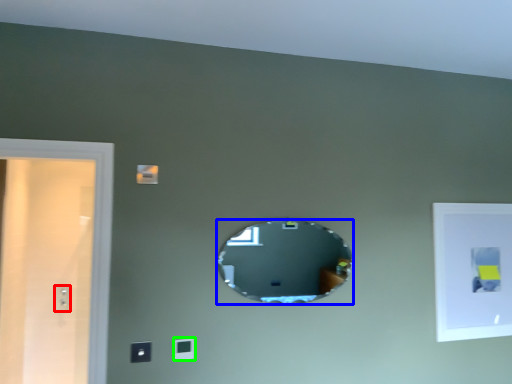
Question: Which object is the closest to the electric outlet (highlighted by a red box)? Choose among these: mirror (highlighted by a blue box) or light switch (highlighted by a green box).

Choices:
 (A) mirror
 (B) light switch

Answer: (B)